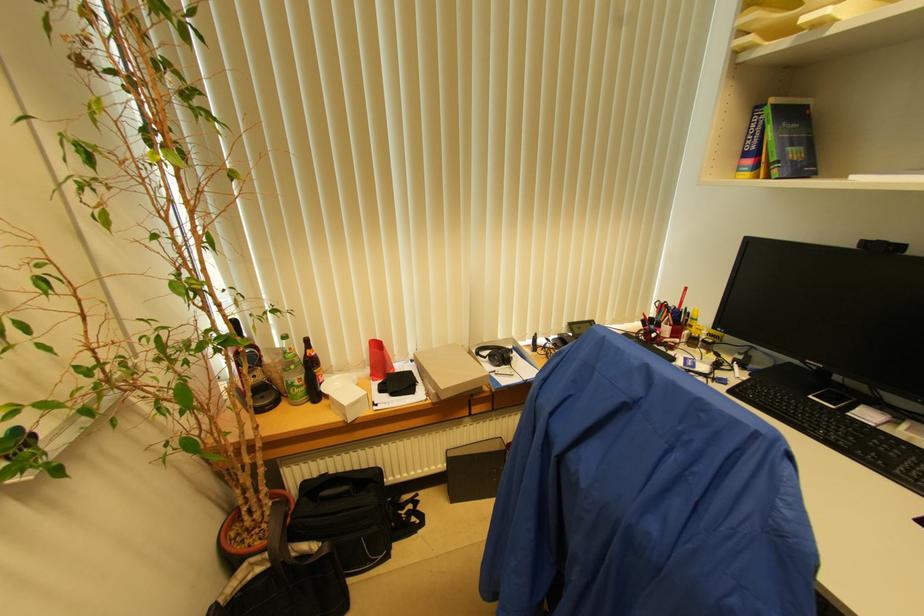
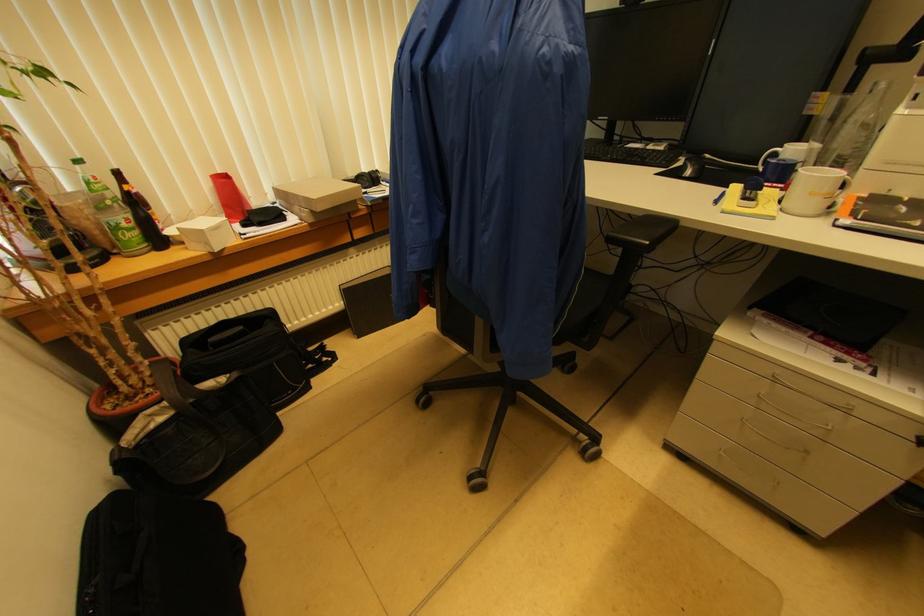
Where in the second image is the point corresponding to pixel 309 342 from the first image?

(118, 176)